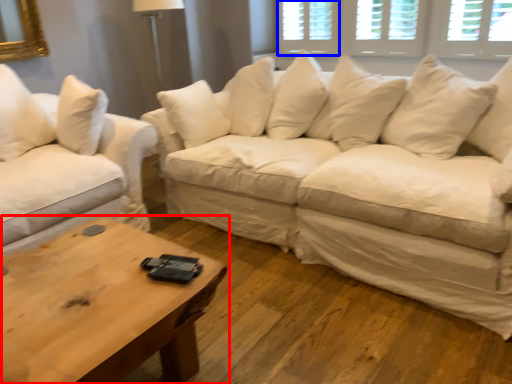
Question: Which of the following is the closest to the observer, coffee table (highlighted by a red box) or window (highlighted by a blue box)?

Choices:
 (A) coffee table
 (B) window

Answer: (A)